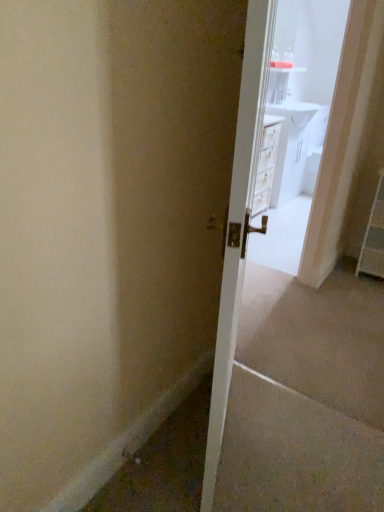
Question: Would you say white glossy door at center is to the left or to the right of white glossy vanity at upper center in the picture?

Choices:
 (A) left
 (B) right

Answer: (A)

Question: Would you say white glossy door at center is inside or outside white glossy vanity at upper center?

Choices:
 (A) outside
 (B) inside

Answer: (A)

Question: Which of these objects is positioned closest to the white glossy vanity at upper center?

Choices:
 (A) white glossy door at center
 (B) white plastic dresser at right

Answer: (B)

Question: Which object is the farthest from the white glossy door at center?

Choices:
 (A) white plastic dresser at right
 (B) white glossy vanity at upper center

Answer: (B)